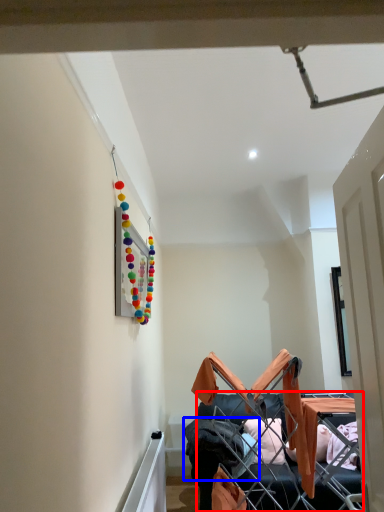
Question: Which object appears closest to the camera in this image, furniture (highlighted by a red box) or clothing (highlighted by a blue box)?

Choices:
 (A) furniture
 (B) clothing

Answer: (A)